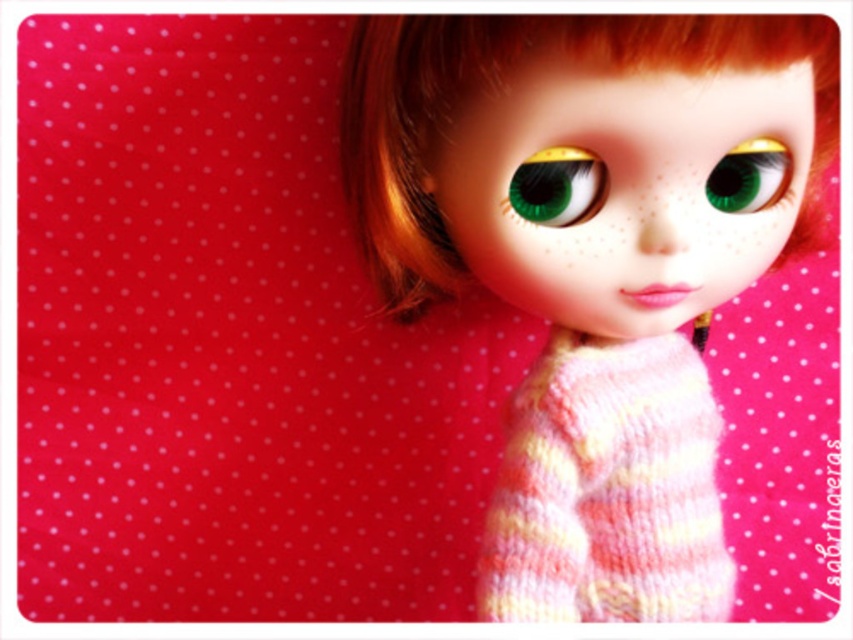
Question: Which object is closer to the camera taking this photo?

Choices:
 (A) green matte eye at center
 (B) green matte eye at upper center
 (C) striped knit sweater at center
 (D) knitted sweater at center

Answer: (D)

Question: Is striped knit sweater at center to the left of green matte eye at center from the viewer's perspective?

Choices:
 (A) yes
 (B) no

Answer: (B)

Question: Considering the relative positions of knitted sweater at center and green matte eye at upper center in the image provided, where is knitted sweater at center located with respect to green matte eye at upper center?

Choices:
 (A) above
 (B) below

Answer: (B)

Question: Which object appears farthest from the camera in this image?

Choices:
 (A) green matte eye at center
 (B) knitted sweater at center
 (C) striped knit sweater at center
 (D) green matte eye at upper center

Answer: (C)

Question: Can you confirm if knitted sweater at center is wider than green matte eye at center?

Choices:
 (A) no
 (B) yes

Answer: (B)

Question: Based on their relative distances, which object is nearer to the green matte eye at upper center?

Choices:
 (A) knitted sweater at center
 (B) green matte eye at center
 (C) striped knit sweater at center

Answer: (B)